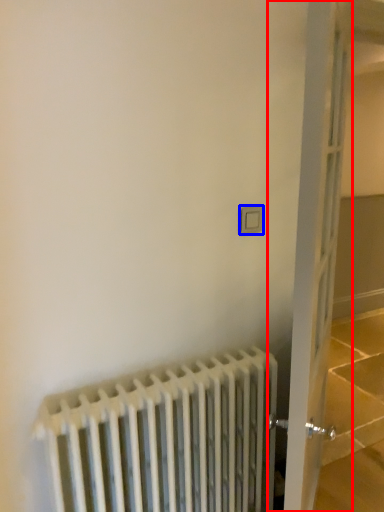
Question: Which of the following is the farthest to the observer, door (highlighted by a red box) or electric outlet (highlighted by a blue box)?

Choices:
 (A) door
 (B) electric outlet

Answer: (B)